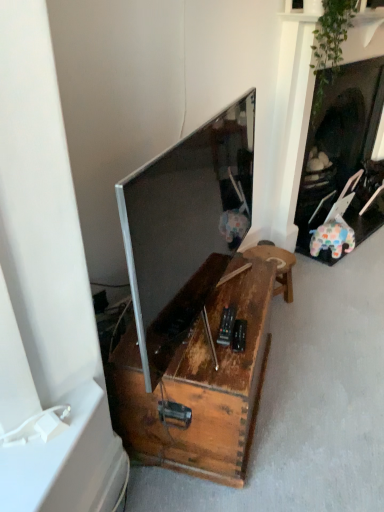
This screenshot has width=384, height=512. What do you see at coordinates (183, 222) in the screenshot?
I see `satin silver television at center` at bounding box center [183, 222].

In the scene shown: What is the approximate width of rusty wood table at center?

rusty wood table at center is 54.55 centimeters in width.

I want to click on satin silver television at center, so click(x=183, y=222).

Does satin silver television at center turn towards rustic wood stool at lower center?

No, satin silver television at center is not turned towards rustic wood stool at lower center.

How different are the orientations of satin silver television at center and rustic wood stool at lower center in degrees?

They differ by 30.1 degrees in their facing directions.

From the image's perspective, which one is positioned lower, satin silver television at center or rustic wood stool at lower center?

rustic wood stool at lower center appears lower in the image.

How distant is satin silver television at center from rusty wood table at center?

10.79 inches.

Between satin silver television at center and rusty wood table at center, which one has larger width?

rusty wood table at center.

Which point is more distant from viewer, (240, 238) or (253, 335)?

The point (240, 238) is farther.

Is satin silver television at center bigger than rusty wood table at center?

No.

How distant is rusty wood table at center from rustic wood stool at lower center?

The distance of rusty wood table at center from rustic wood stool at lower center is 52.91 centimeters.

Is rusty wood table at center in contact with rustic wood stool at lower center?

No, rusty wood table at center is not touching rustic wood stool at lower center.

Is rusty wood table at center oriented away from rustic wood stool at lower center?

rusty wood table at center is not turned away from rustic wood stool at lower center.

I want to click on table that is in front of the rustic wood stool at lower center, so click(199, 372).

Is rustic wood stool at lower center aimed at satin silver television at center?

No.

Does rustic wood stool at lower center contain satin silver television at center?

Actually, satin silver television at center is outside rustic wood stool at lower center.

Find the location of a particular element. The width and height of the screenshot is (384, 512). television in front of the rustic wood stool at lower center is located at coordinates (183, 222).

From a real-world perspective, is rusty wood table at center physically above satin silver television at center?

No, from a real-world perspective, rusty wood table at center is not over satin silver television at center

Considering the sizes of rusty wood table at center and satin silver television at center in the image, is rusty wood table at center bigger or smaller than satin silver television at center?

In the image, rusty wood table at center appears to be larger than satin silver television at center.

Considering the positions of points (245, 359) and (210, 196), is point (245, 359) farther from camera compared to point (210, 196)?

Yes, point (245, 359) is behind point (210, 196).

From a real-world perspective, is rustic wood stool at lower center under rusty wood table at center?

Yes, from a real-world perspective, rustic wood stool at lower center is under rusty wood table at center.

The image size is (384, 512). I want to click on furniture that is on the right side of rusty wood table at center, so [277, 266].

Can we say rustic wood stool at lower center lies outside rusty wood table at center?

Yes, rustic wood stool at lower center is not within rusty wood table at center.

The image size is (384, 512). I want to click on furniture that is below the satin silver television at center (from the image's perspective), so click(277, 266).

You are a GUI agent. You are given a task and a screenshot of the screen. Output one action in this format:
    pyautogui.click(x=<x>, y=<y>)
    Task: Click on the television above the rusty wood table at center (from the image's perspective)
    
    Given the screenshot: What is the action you would take?
    pyautogui.click(x=183, y=222)

Based on the photo, which object lies nearer to the anchor point rustic wood stool at lower center, satin silver television at center or rusty wood table at center?

rusty wood table at center lies closer to rustic wood stool at lower center than the other object.

Estimate the real-world distances between objects in this image. Which object is closer to rustic wood stool at lower center, rusty wood table at center or satin silver television at center?

rusty wood table at center is closer to rustic wood stool at lower center.

When comparing their distances from satin silver television at center, does rusty wood table at center or rustic wood stool at lower center seem closer?

rusty wood table at center is closer to satin silver television at center.

Which object lies further to the anchor point satin silver television at center, rustic wood stool at lower center or rusty wood table at center?

Among the two, rustic wood stool at lower center is located further to satin silver television at center.

Estimate the real-world distances between objects in this image. Which object is closer to rusty wood table at center, rustic wood stool at lower center or satin silver television at center?

satin silver television at center is closer to rusty wood table at center.

Looking at the image, which one is located further to rusty wood table at center, satin silver television at center or rustic wood stool at lower center?

rustic wood stool at lower center.

This screenshot has height=512, width=384. What are the coordinates of `table between satin silver television at center and rustic wood stool at lower center along the z-axis` in the screenshot? It's located at (199, 372).